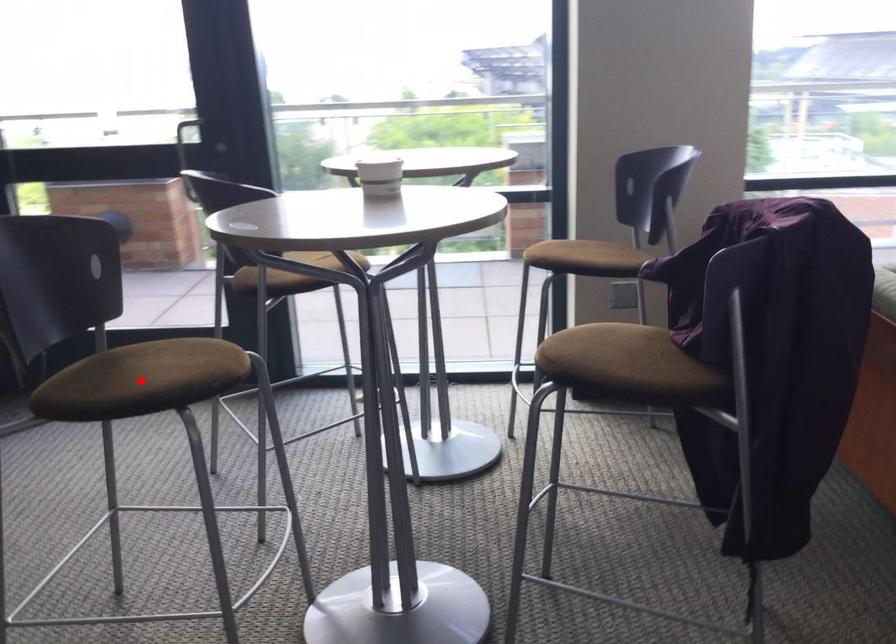
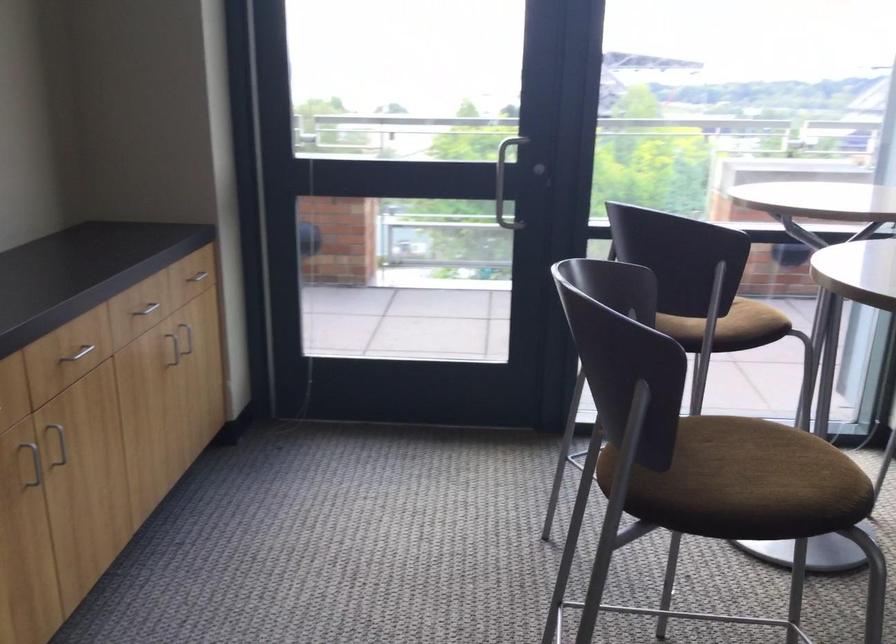
Question: I am providing you with two images of the same scene from different viewpoints. A red point is shown in image1. For the corresponding object point in image2, is it positioned nearer or farther from the camera?

Choices:
 (A) Nearer
 (B) Farther

Answer: (A)